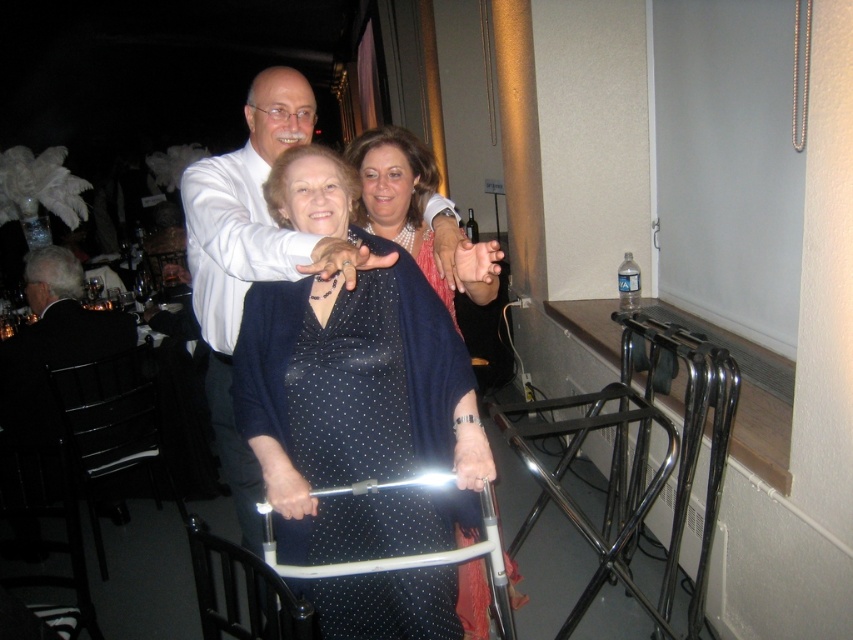
From the picture: Can you confirm if polka dot fabric walker at center is taller than black leather chair at left?

Correct, polka dot fabric walker at center is much taller as black leather chair at left.

Does point (347, 468) come behind point (73, 336)?

No, (347, 468) is closer to viewer.

The height and width of the screenshot is (640, 853). In order to click on polka dot fabric walker at center in this screenshot , I will do [357, 412].